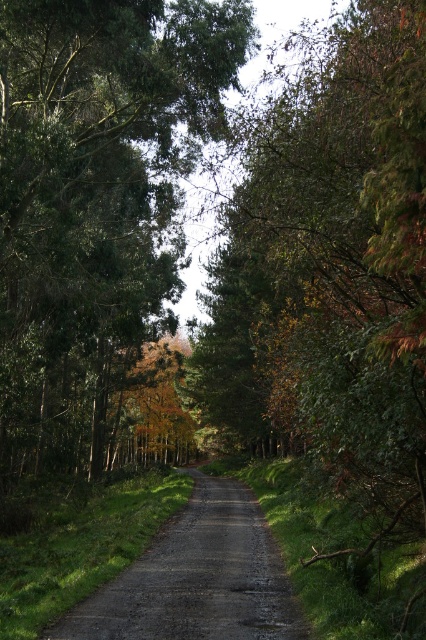
Question: Is green matte tree at center positioned in front of dull gray gravel road at center?

Choices:
 (A) no
 (B) yes

Answer: (A)

Question: Is green matte tree at center below dull gray gravel road at center?

Choices:
 (A) no
 (B) yes

Answer: (A)

Question: Is green matte tree at center positioned behind dull gray gravel road at center?

Choices:
 (A) no
 (B) yes

Answer: (B)

Question: Which of the following is the closest to the observer?

Choices:
 (A) dull gray gravel road at center
 (B) green matte tree at center

Answer: (A)